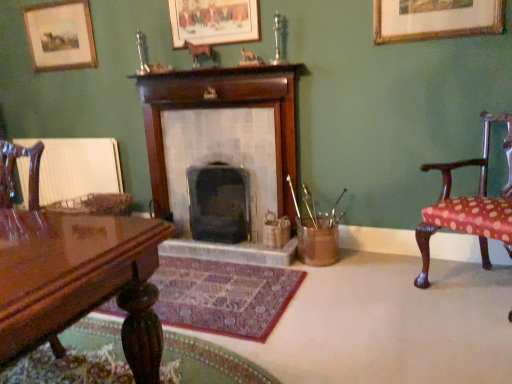
You are a GUI agent. You are given a task and a screenshot of the screen. Output one action in this format:
    pyautogui.click(x=<x>, y=<y>)
    Task: Click on the vacant area situated to the left side of polka dot fabric chair at right, which is the second chair in left-to-right order
    
    Given the screenshot: What is the action you would take?
    pyautogui.click(x=387, y=295)